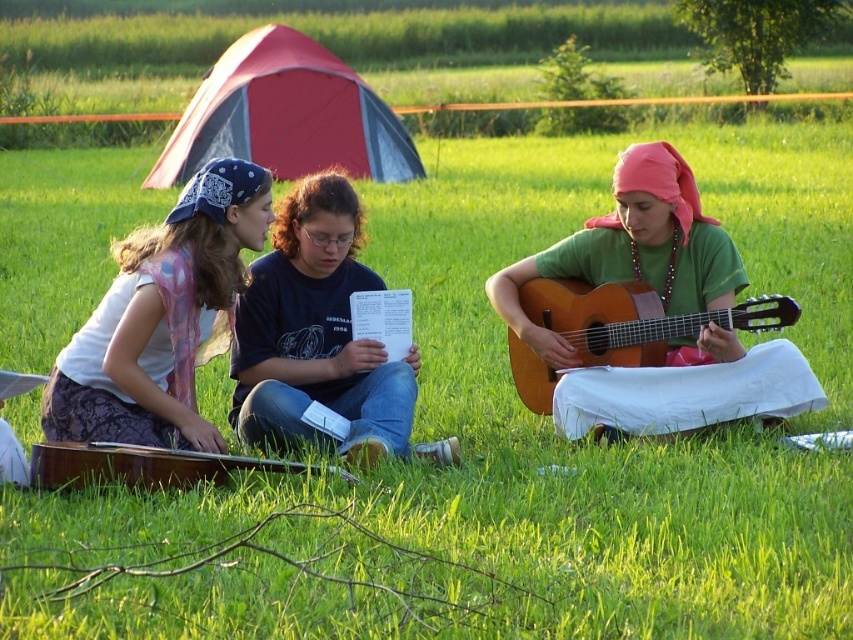
Is matte black shirt at center positioned before brown wooden guitar at lower left?

That is False.

Does matte black shirt at center appear under brown wooden guitar at lower left?

Incorrect, matte black shirt at center is not positioned below brown wooden guitar at lower left.

Locate an element on the screen. matte black shirt at center is located at coordinates (316, 336).

Which of these two, red fabric tent at upper center or acoustic wood guitar at right, stands taller?

red fabric tent at upper center

Does point (345, 134) come in front of point (540, 365)?

No.

Which is behind, point (271, 38) or point (769, 304)?

The point (271, 38) is behind.

Locate an element on the screen. Image resolution: width=853 pixels, height=640 pixels. red fabric tent at upper center is located at coordinates (286, 115).

Does matte pink scarf at left appear on the right side of red fabric tent at upper center?

Indeed, matte pink scarf at left is positioned on the right side of red fabric tent at upper center.

Does matte pink scarf at left have a greater height compared to red fabric tent at upper center?

Indeed, matte pink scarf at left has a greater height compared to red fabric tent at upper center.

Does point (125, 273) lie behind point (305, 67)?

No, it is in front of (305, 67).

At what (x,y) coordinates should I click in order to perform the action: click on matte pink scarf at left. Please return your answer as a coordinate pair (x, y). Looking at the image, I should click on (161, 317).